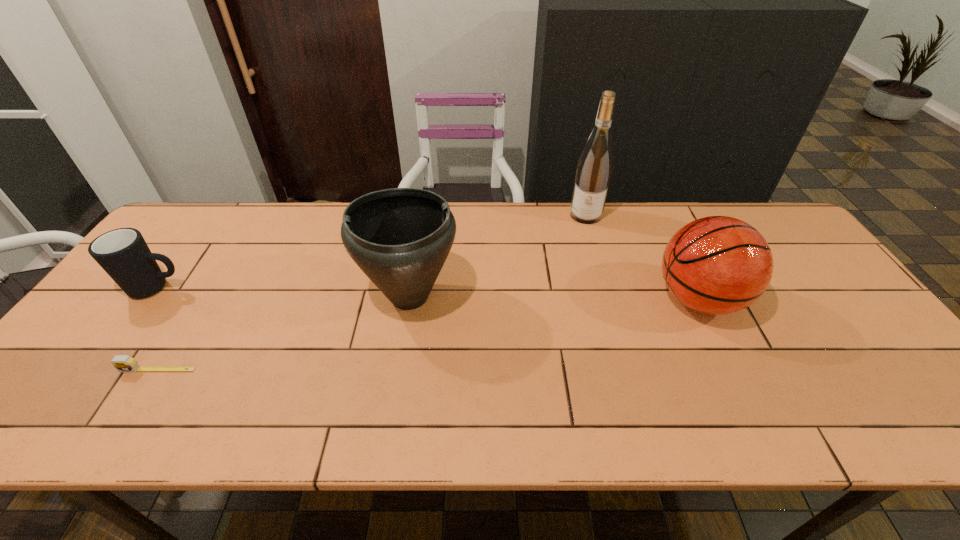
You are a GUI agent. You are given a task and a screenshot of the screen. Output one action in this format:
    pyautogui.click(x=<x>, y=<y>)
    Task: Click on the empty space between the wine bottle and the urn
    The width and height of the screenshot is (960, 540).
    Given the screenshot: What is the action you would take?
    pyautogui.click(x=498, y=255)

I want to click on empty space between the urn and the mug, so click(x=284, y=292).

Identify the location of free space between the mug and the third object from right to left. The image size is (960, 540). (284, 292).

This screenshot has width=960, height=540. I want to click on the closest object relative to the mug, so click(x=123, y=363).

Identify which object is the third nearest to the mug. Please provide its 2D coordinates. Your answer should be formatted as a tuple, i.e. [(x, y)], where the tuple contains the x and y coordinates of a point satisfying the conditions above.

[(594, 170)]

Locate an element on the screen. free space that satisfies the following two spatial constraints: 1. on the back side of the third object from right to left; 2. on the side of the second shortest object with the handle is located at coordinates (411, 288).

Locate an element on the screen. vacant space that satisfies the following two spatial constraints: 1. on the side of the mug with the handle; 2. on the left side of the urn is located at coordinates 152,296.